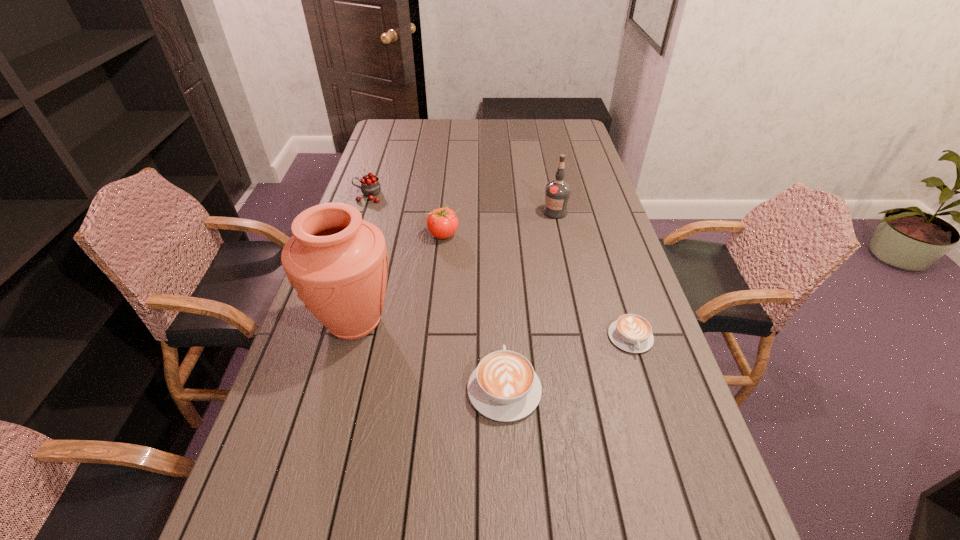
This screenshot has height=540, width=960. I want to click on vodka located at the right edge, so click(557, 192).

The height and width of the screenshot is (540, 960). I want to click on vacant area at the far edge of the desktop, so click(457, 119).

In the image, there is a desktop. Where is `vacant area at the near edge`? The image size is (960, 540). vacant area at the near edge is located at coordinates (599, 463).

In the image, there is a desktop. Identify the location of vacant space at the left edge. This screenshot has height=540, width=960. (388, 146).

The height and width of the screenshot is (540, 960). Find the location of `vacant region at the right edge of the desktop`. vacant region at the right edge of the desktop is located at coordinates (583, 146).

I want to click on vacant area that lies between the tomato and the second tallest object, so click(499, 223).

I want to click on free space between the tallest object and the tomato, so click(399, 278).

Find the location of `free space between the fifth tallest object and the vase`. free space between the fifth tallest object and the vase is located at coordinates (429, 355).

Locate an element on the screen. The height and width of the screenshot is (540, 960). vacant space that is in between the tomato and the nearer cappuccino is located at coordinates (474, 312).

What are the coordinates of `free space between the right cappuccino and the tomato` in the screenshot? It's located at (537, 286).